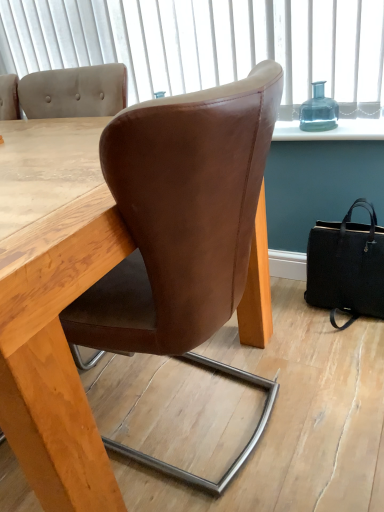
Identify the location of vacant area that lies in front of black leather handbag at lower right. This screenshot has height=512, width=384. (355, 339).